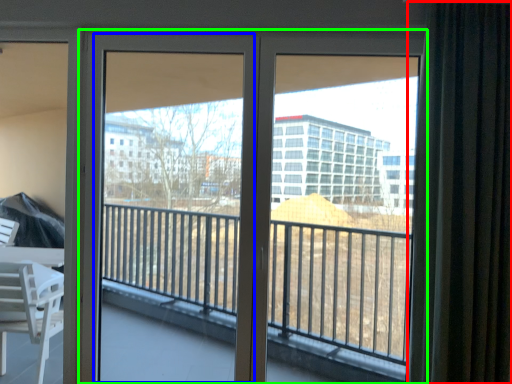
Question: Which object is the farthest from curtain (highlighted by a red box)? Choose among these: screen door (highlighted by a blue box) or door (highlighted by a green box).

Choices:
 (A) screen door
 (B) door

Answer: (A)